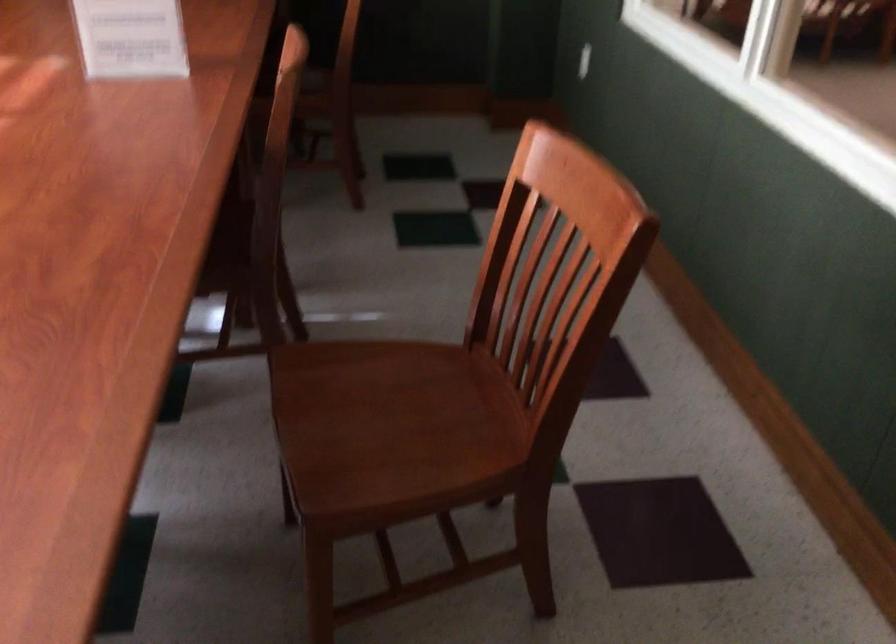
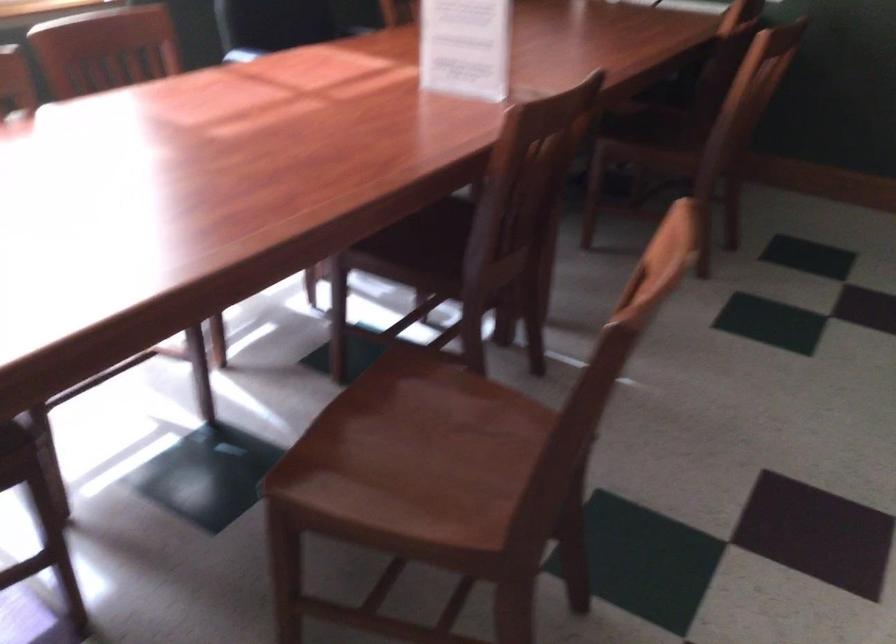
In the second image, find the point that corresponds to pixel 398 429 in the first image.

(412, 458)